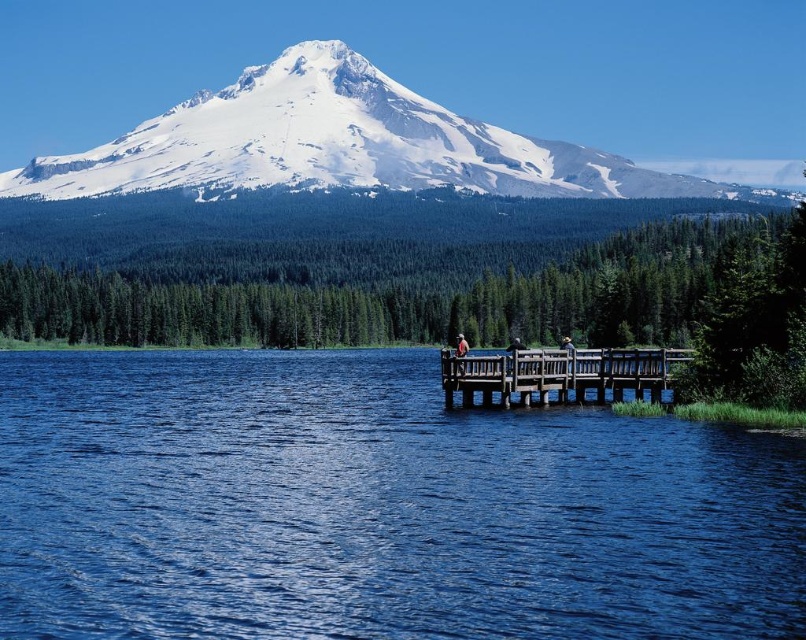
What do you see at coordinates (374, 506) in the screenshot?
I see `blue water at center` at bounding box center [374, 506].

Is blue water at center further to the viewer compared to wooden dock at center?

No.

Where is `blue water at center`? This screenshot has height=640, width=806. blue water at center is located at coordinates (374, 506).

Does wooden dock at center have a lesser height compared to light brown wooden dock at center?

Incorrect, wooden dock at center's height does not fall short of light brown wooden dock at center's.

Is the position of wooden dock at center less distant than that of light brown wooden dock at center?

Yes, wooden dock at center is in front of light brown wooden dock at center.

Where is `wooden dock at center`? wooden dock at center is located at coordinates (563, 376).

Between light brown wooden dock at center and brown woven hat at center, which one has less height?

Standing shorter between the two is light brown wooden dock at center.

Measure the distance from light brown wooden dock at center to brown woven hat at center.

light brown wooden dock at center is 51.94 feet from brown woven hat at center.

Is point (467, 349) positioned behind point (568, 337)?

No, it is not.

Find the location of a particular element. This screenshot has width=806, height=640. light brown wooden dock at center is located at coordinates (460, 355).